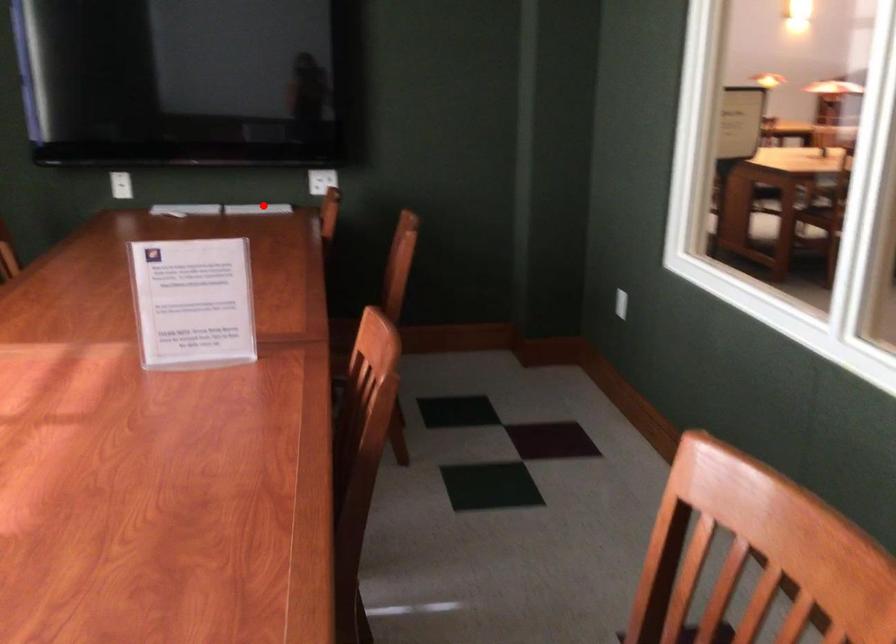
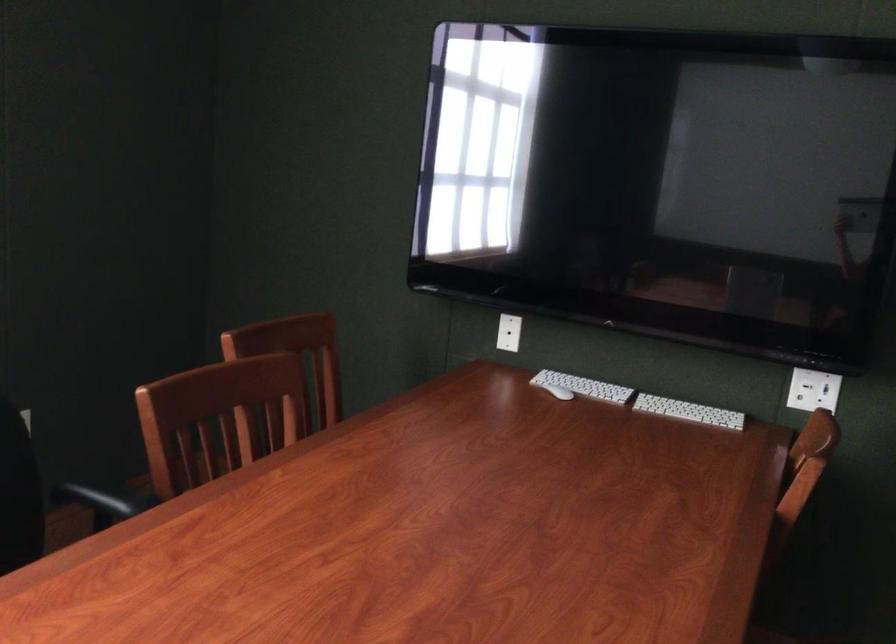
Question: I am providing you with two images of the same scene from different viewpoints. Given a red point in image1, look at the same physical point in image2. Is it:

Choices:
 (A) Closer to the viewpoint
 (B) Farther from the viewpoint

Answer: (A)